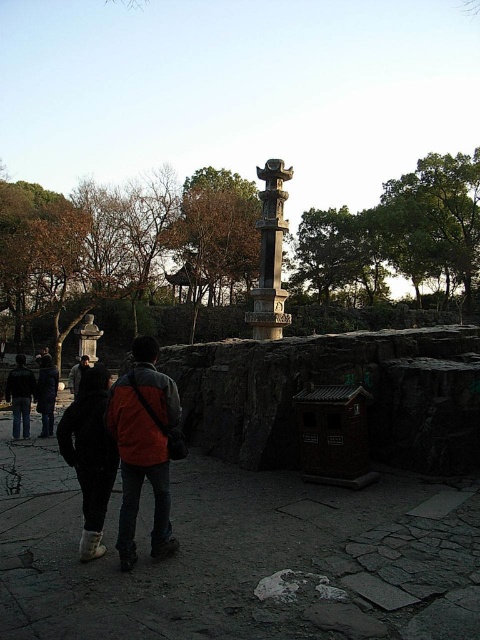
Question: Can you confirm if orange fabric jacket at lower left is wider than jeans at center?

Choices:
 (A) no
 (B) yes

Answer: (A)

Question: Which point is farther to the camera?

Choices:
 (A) (15, 416)
 (B) (100, 448)
 (C) (146, 342)

Answer: (A)

Question: Among these objects, which one is nearest to the camera?

Choices:
 (A) polished stone monument at center
 (B) jeans at center
 (C) orange fabric jacket at lower left

Answer: (C)

Question: Is orange fabric jacket at lower left bigger than orange jacket at center?

Choices:
 (A) no
 (B) yes

Answer: (A)

Question: Does dark gray jeans at center lie in front of dark blue jeans at center?

Choices:
 (A) no
 (B) yes

Answer: (B)

Question: Which point appears closest to the camera in this image?

Choices:
 (A) (91, 355)
 (B) (276, 276)
 (C) (80, 372)

Answer: (C)